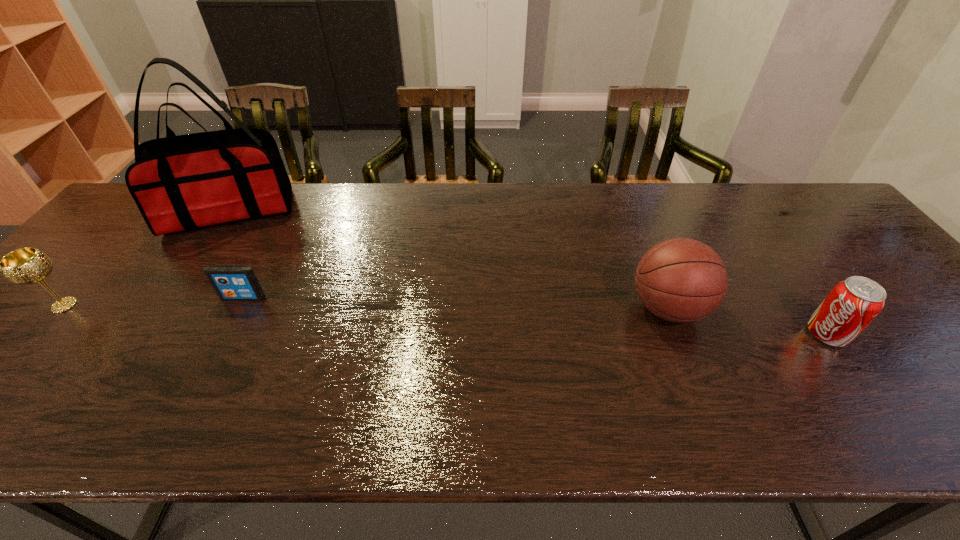
You are a GUI agent. You are given a task and a screenshot of the screen. Output one action in this format:
    pyautogui.click(x=<x>, y=<y>)
    Task: Click on the empty space that is in between the leftmost object and the farthest object
    Image resolution: width=960 pixels, height=540 pixels.
    Given the screenshot: What is the action you would take?
    pyautogui.click(x=147, y=259)

Find the location of a particular element. vacant region between the rightmost object and the second tallest object is located at coordinates (747, 321).

This screenshot has height=540, width=960. Identify the location of vacant space that is in between the basketball and the rightmost object. (747, 321).

The image size is (960, 540). I want to click on vacant area that lies between the fourth object from left to right and the farthest object, so click(x=448, y=260).

Find the location of a particular element. free space between the soda and the chalice is located at coordinates (445, 320).

The image size is (960, 540). In order to click on free spot between the shortest object and the basketball in this screenshot , I will do `click(456, 303)`.

Locate an element on the screen. This screenshot has width=960, height=540. vacant area between the fourth object from left to right and the rightmost object is located at coordinates (747, 321).

Where is `free point between the soda and the second tallest object`? Image resolution: width=960 pixels, height=540 pixels. free point between the soda and the second tallest object is located at coordinates (747, 321).

I want to click on free space between the chalice and the rightmost object, so click(445, 320).

You are a GUI agent. You are given a task and a screenshot of the screen. Output one action in this format:
    pyautogui.click(x=<x>, y=<y>)
    Task: Click on the vacant space that's between the soda and the leftmost object
    The image size is (960, 540).
    Given the screenshot: What is the action you would take?
    pyautogui.click(x=445, y=320)